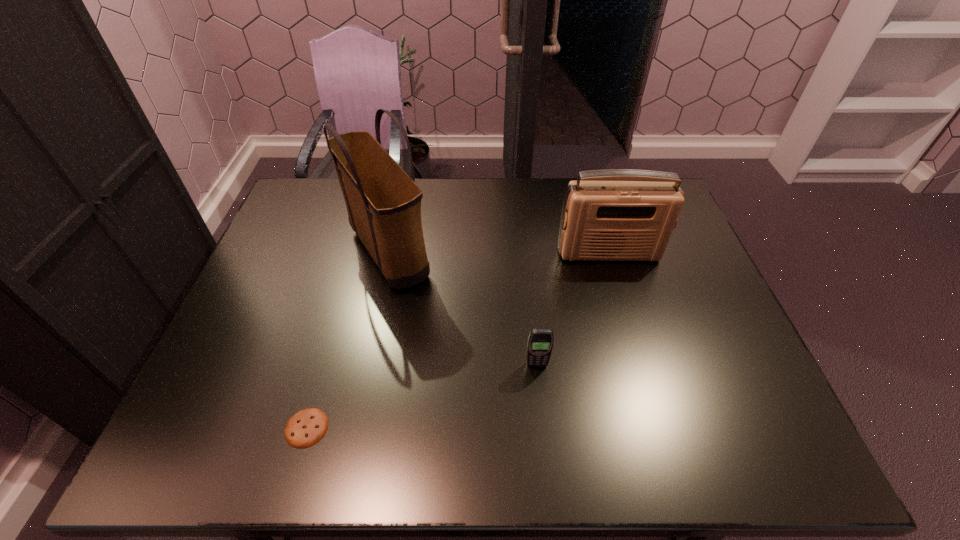
Identify the location of the tallest object. (383, 203).

This screenshot has height=540, width=960. In order to click on the third shortest object in this screenshot , I will do `click(618, 214)`.

Identify the location of radio receiver. Image resolution: width=960 pixels, height=540 pixels. (618, 214).

Locate an element on the screen. cellular telephone is located at coordinates coord(540,341).

Locate an element on the screen. The width and height of the screenshot is (960, 540). the second object from right to left is located at coordinates (540, 341).

Where is `the shortest object`? The width and height of the screenshot is (960, 540). the shortest object is located at coordinates (x=305, y=428).

Find the location of a particular element. The image size is (960, 540). cookie is located at coordinates (305, 428).

The width and height of the screenshot is (960, 540). In order to click on free space located 0.070m on the back of the tote bag in this screenshot , I will do `click(398, 201)`.

Where is `free region located on the front-facing side of the rightmost object`? The width and height of the screenshot is (960, 540). free region located on the front-facing side of the rightmost object is located at coordinates pyautogui.click(x=637, y=349).

The width and height of the screenshot is (960, 540). I want to click on vacant space located 0.190m on the screen of the second nearest object, so click(545, 446).